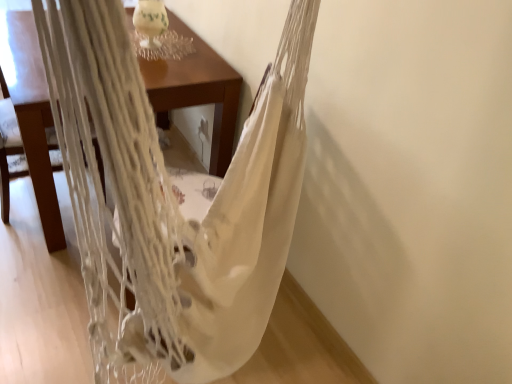
Question: Is white macrame hammock at center bigger than white woven hammock at upper left?

Choices:
 (A) yes
 (B) no

Answer: (A)

Question: Would you say white macrame hammock at center is a long distance from white woven hammock at upper left?

Choices:
 (A) no
 (B) yes

Answer: (B)

Question: From a real-world perspective, is white macrame hammock at center positioned over white woven hammock at upper left based on gravity?

Choices:
 (A) yes
 (B) no

Answer: (A)

Question: Does white macrame hammock at center touch white woven hammock at upper left?

Choices:
 (A) no
 (B) yes

Answer: (A)

Question: From the image's perspective, is white macrame hammock at center beneath white woven hammock at upper left?

Choices:
 (A) yes
 (B) no

Answer: (A)

Question: Does white macrame hammock at center have a lesser width compared to white woven hammock at upper left?

Choices:
 (A) yes
 (B) no

Answer: (B)

Question: Can you see white woven hammock at upper left touching white macrame hammock at center?

Choices:
 (A) no
 (B) yes

Answer: (A)

Question: Considering the relative positions of white woven hammock at upper left and white macrame hammock at center in the image provided, is white woven hammock at upper left to the right of white macrame hammock at center from the viewer's perspective?

Choices:
 (A) yes
 (B) no

Answer: (B)

Question: Is white woven hammock at upper left closer to the viewer compared to white macrame hammock at center?

Choices:
 (A) yes
 (B) no

Answer: (B)

Question: Is white woven hammock at upper left not within white macrame hammock at center?

Choices:
 (A) no
 (B) yes

Answer: (B)

Question: Does white woven hammock at upper left lie behind white macrame hammock at center?

Choices:
 (A) no
 (B) yes

Answer: (B)

Question: Is white woven hammock at upper left surrounding white macrame hammock at center?

Choices:
 (A) no
 (B) yes

Answer: (A)

Question: Are white woven hammock at upper left and wooden table at center beside each other?

Choices:
 (A) yes
 (B) no

Answer: (B)